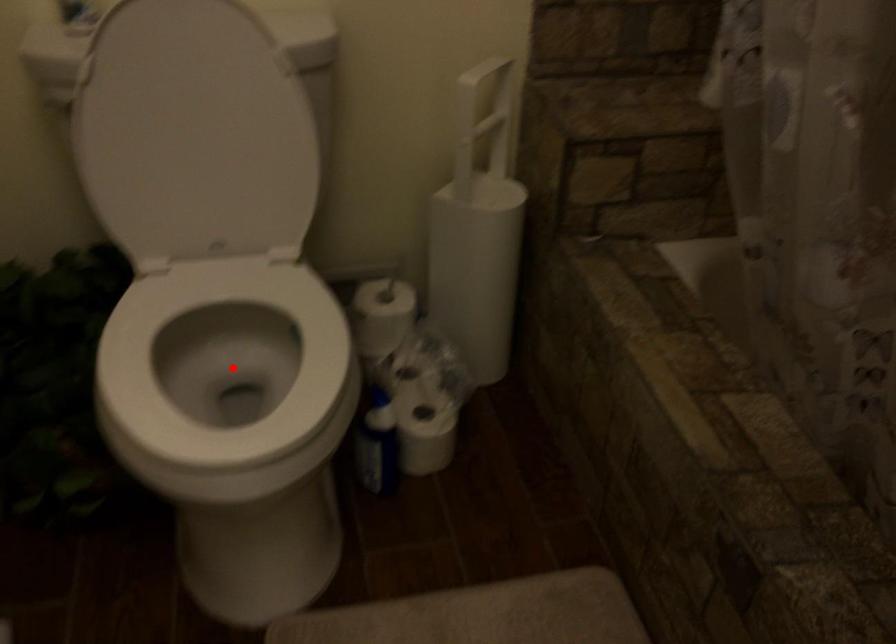
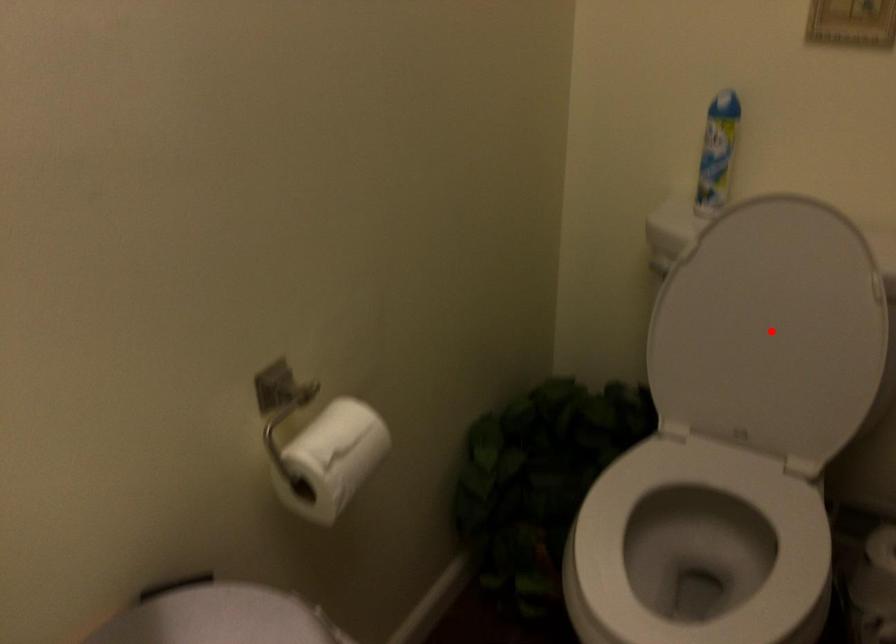
I am providing you with two images of the same scene from different viewpoints. A red point is marked on the first image and another point is marked on the second image. Does the point marked in image1 correspond to the same location as the one in image2?

No